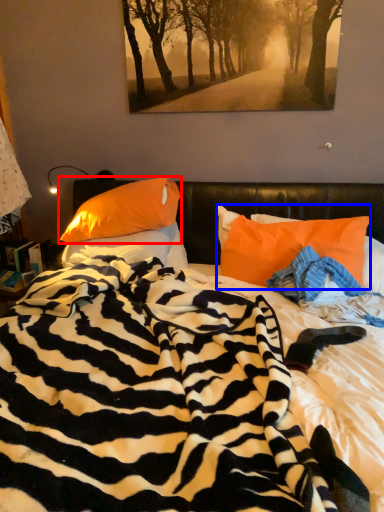
Question: Which point is further to the camera, pillow (highlighted by a red box) or pillow (highlighted by a blue box)?

Choices:
 (A) pillow
 (B) pillow

Answer: (A)